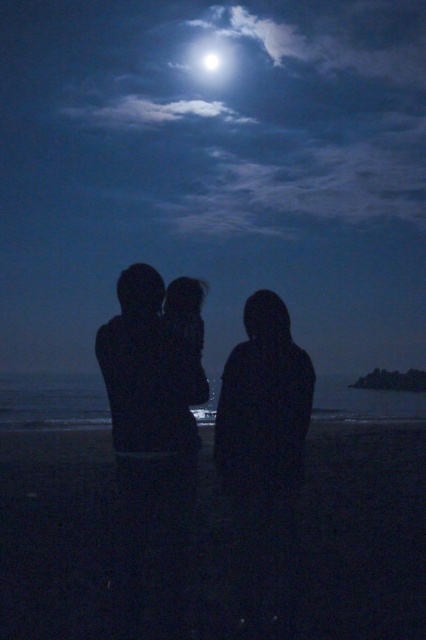
Question: Is dark sand at lower center above bright white sphere at upper center?

Choices:
 (A) yes
 (B) no

Answer: (B)

Question: Can you confirm if bright white orb at upper center is positioned below bright white sphere at upper center?

Choices:
 (A) no
 (B) yes

Answer: (A)

Question: Estimate the real-world distances between objects in this image. Which object is closer to the bright white sphere at upper center?

Choices:
 (A) bright white orb at upper center
 (B) dark sand at lower center

Answer: (A)

Question: Considering the relative positions of bright white orb at upper center and bright white sphere at upper center in the image provided, where is bright white orb at upper center located with respect to bright white sphere at upper center?

Choices:
 (A) right
 (B) left

Answer: (B)

Question: Which of these objects is positioned farthest from the dark sand at lower center?

Choices:
 (A) bright white sphere at upper center
 (B) bright white orb at upper center

Answer: (A)

Question: Which object is the closest to the bright white sphere at upper center?

Choices:
 (A) dark sand at lower center
 (B) bright white orb at upper center

Answer: (B)